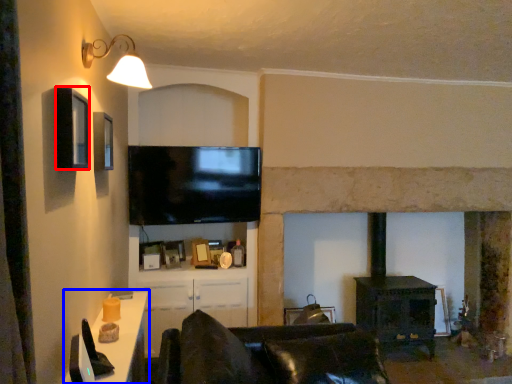
Question: Which of the following is the farthest to the observer, window (highlighted by a red box) or table (highlighted by a blue box)?

Choices:
 (A) window
 (B) table

Answer: (A)